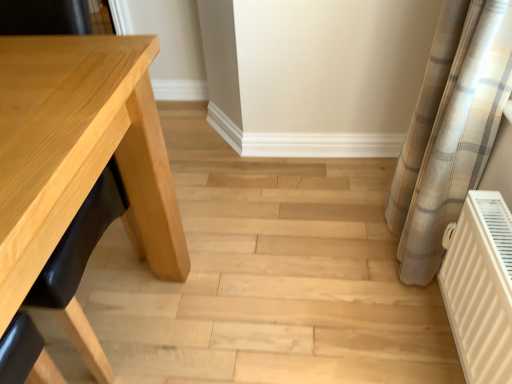
The width and height of the screenshot is (512, 384). I want to click on vacant region to the left of plaid fabric curtain at right, so click(338, 258).